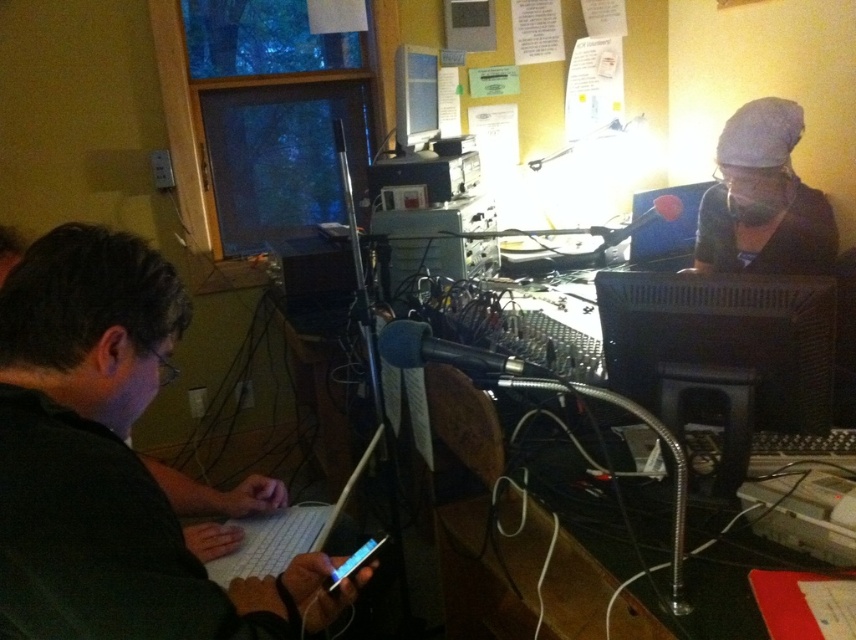
You are a technician in a recording studio. You need to adjust the settings on the black matte laptop at left and the matte black monitor at upper center. Which device should you reach for first if you want to start with the one closer to your eyes?

The matte black monitor at upper center is closer to your eyes since it is positioned above the black matte laptop at left, which is located below it.

You are setting up a new microphone stand in this recording studio. The stand needs to be placed between the white plastic laptop at lower center and the matte black monitor at upper center. Based on their positions, where should you position the microphone stand?

The white plastic laptop at lower center is located below the matte black monitor at upper center, so the microphone stand should be placed between them vertically, positioning it below the matte black monitor at upper center and above the white plastic laptop at lower center.